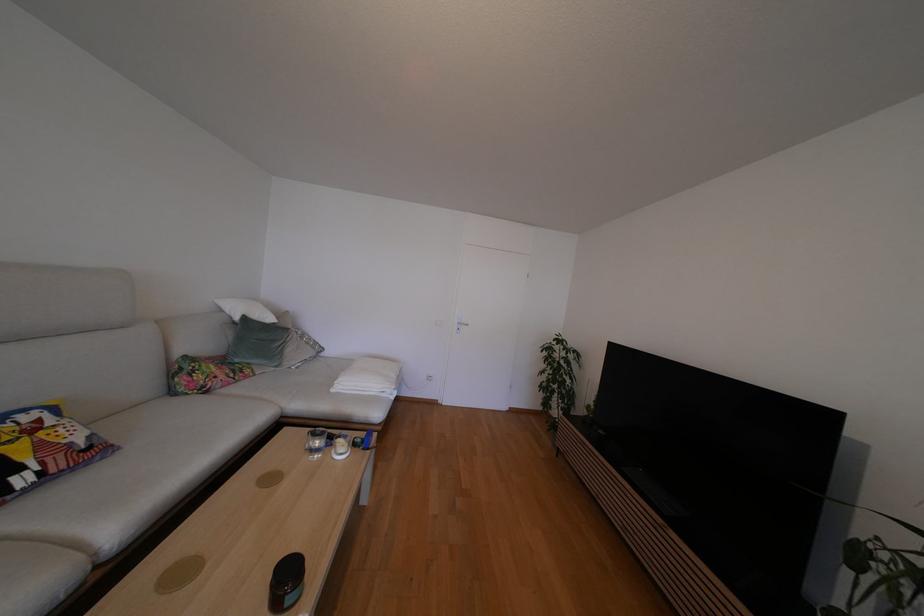
Image resolution: width=924 pixels, height=616 pixels. What do you see at coordinates (257, 342) in the screenshot?
I see `the green velvet pillow` at bounding box center [257, 342].